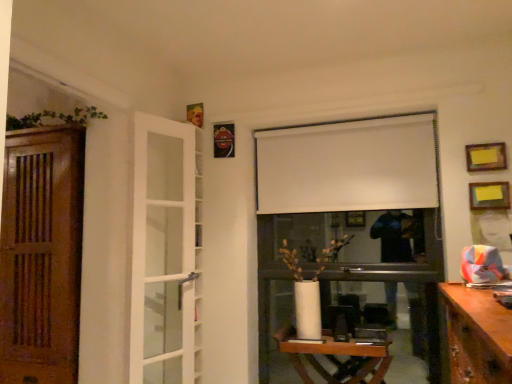
Question: Is metallic rectangular frame at upper center, marked as the 3th picture frame in a front-to-back arrangement, to the left of wooden at left, which is the first door from left to right, from the viewer's perspective?

Choices:
 (A) no
 (B) yes

Answer: (A)

Question: From a real-world perspective, is metallic rectangular frame at upper center, marked as the 3th picture frame in a front-to-back arrangement, over wooden at left, placed as the 2th door when sorted from right to left?

Choices:
 (A) yes
 (B) no

Answer: (A)

Question: Is metallic rectangular frame at upper center, which appears as the third picture frame when viewed from the right, turned away from wooden at left, placed as the 2th door when sorted from right to left?

Choices:
 (A) yes
 (B) no

Answer: (B)

Question: Are metallic rectangular frame at upper center, marked as the 3th picture frame in a front-to-back arrangement, and wooden at left, which is the first door from left to right, located far from each other?

Choices:
 (A) yes
 (B) no

Answer: (A)

Question: Can you confirm if metallic rectangular frame at upper center, the 1th picture frame when ordered from left to right, is positioned to the right of wooden at left, which is the first door from left to right?

Choices:
 (A) no
 (B) yes

Answer: (B)

Question: Choose the correct answer: Is white glass door at left, the first door when ordered from right to left, inside yellow paper at upper right, the 3th picture frame in the top-to-bottom sequence, or outside it?

Choices:
 (A) outside
 (B) inside

Answer: (A)

Question: Looking at their shapes, would you say white glass door at left, the first door when ordered from right to left, is wider or thinner than yellow paper at upper right, the first picture frame from the front?

Choices:
 (A) wide
 (B) thin

Answer: (A)

Question: Would you say white glass door at left, the 2th door from the left, is to the left or to the right of yellow paper at upper right, the first picture frame from the front, in the picture?

Choices:
 (A) right
 (B) left

Answer: (B)

Question: Is white glass door at left, the 2th door from the left, in front of or behind yellow paper at upper right, the first picture frame from the front, in the image?

Choices:
 (A) front
 (B) behind

Answer: (A)

Question: Is point (302, 172) closer or farther from the camera than point (228, 127)?

Choices:
 (A) closer
 (B) farther

Answer: (A)

Question: From the image's perspective, is white matte curtain at upper center positioned above or below metallic rectangular frame at upper center, which appears as the third picture frame when viewed from the right?

Choices:
 (A) above
 (B) below

Answer: (B)

Question: In terms of height, does white matte curtain at upper center look taller or shorter compared to metallic rectangular frame at upper center, positioned as the 1th picture frame in top-to-bottom order?

Choices:
 (A) short
 (B) tall

Answer: (B)

Question: Based on their sizes in the image, would you say white matte curtain at upper center is bigger or smaller than metallic rectangular frame at upper center, positioned as the 1th picture frame in top-to-bottom order?

Choices:
 (A) big
 (B) small

Answer: (A)

Question: Based on their positions, is white glass door at left, the 2th door from the left, located to the left or right of metallic rectangular frame at upper center, positioned as the 1th picture frame in top-to-bottom order?

Choices:
 (A) left
 (B) right

Answer: (A)

Question: Based on their sizes in the image, would you say white glass door at left, the first door when ordered from right to left, is bigger or smaller than metallic rectangular frame at upper center, which appears as the third picture frame when viewed from the right?

Choices:
 (A) big
 (B) small

Answer: (A)